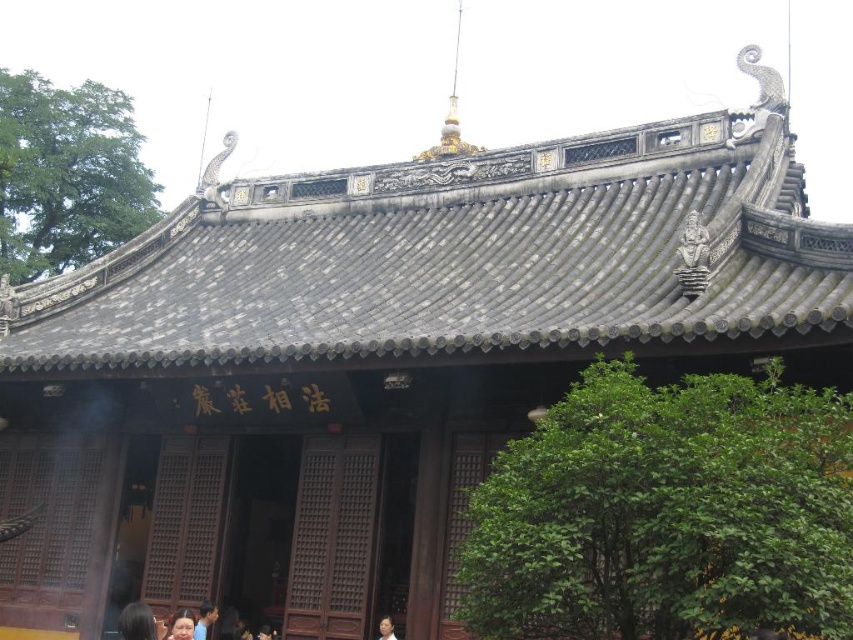
From the picture: You are a photographer standing at the camera position. You want to take a closeup shot of the smooth skin face at lower center. Given that your camera can focus on objects within 40 meters, will you be able to capture a clear image?

The smooth skin face at lower center is 39.56 meters away from the camera. Since the camera can focus within 40 meters, it is within range, so yes, you can capture a clear image.